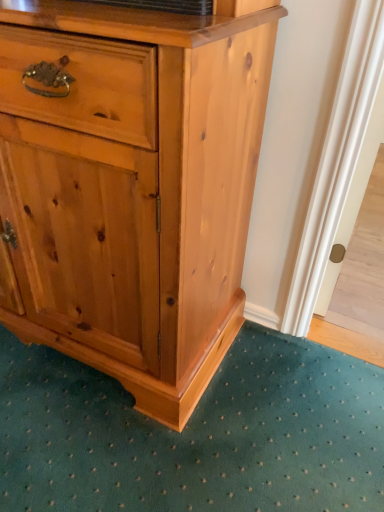
This screenshot has width=384, height=512. I want to click on teal carpet at lower center, so [x=195, y=434].

Describe the element at coordinates (195, 434) in the screenshot. I see `teal carpet at lower center` at that location.

Locate an element on the screen. teal carpet at lower center is located at coordinates (195, 434).